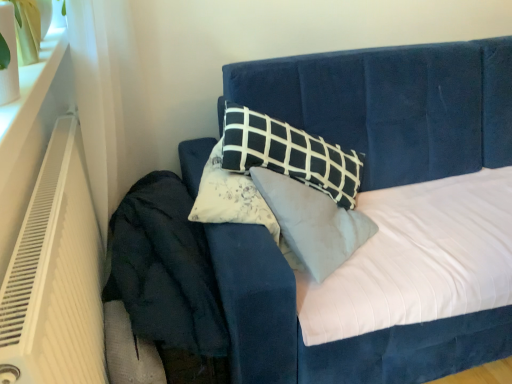
Measure the distance between velvet blue bed at center and camera.

They are 1.38 meters apart.

Describe the element at coordinates (55, 276) in the screenshot. Image resolution: width=512 pixels, height=384 pixels. I see `white plastic heater at left` at that location.

I want to click on velvet blue bed at center, so click(x=393, y=105).

Does white plastic heater at left turn towards dark blue velvet at lower left?

Yes, white plastic heater at left is oriented towards dark blue velvet at lower left.

Is white plastic heater at left touching dark blue velvet at lower left?

white plastic heater at left is not next to dark blue velvet at lower left, and they're not touching.

What's the angular difference between white plastic heater at left and dark blue velvet at lower left's facing directions?

90 degrees.

From a real-world perspective, between white plastic heater at left and dark blue velvet at lower left, who is vertically lower?

dark blue velvet at lower left is physically lower.

Which is more to the left, dark blue velvet at lower left or white plastic heater at left?

white plastic heater at left.

From a real-world perspective, between dark blue velvet at lower left and white plastic heater at left, who is vertically lower?

dark blue velvet at lower left is physically lower.

Is point (131, 210) closer or farther from the camera than point (41, 337)?

Point (131, 210) is positioned farther from the camera compared to point (41, 337).

Is white plastic heater at left thinner than velvet blue bed at center?

Correct, the width of white plastic heater at left is less than that of velvet blue bed at center.

Is point (94, 319) closer or farther from the camera than point (463, 149)?

Point (94, 319) appears to be closer to the viewer than point (463, 149).

Is velvet blue bed at center inside white plastic heater at left?

No, velvet blue bed at center is not a part of white plastic heater at left.

What's the angular difference between white plastic heater at left and velvet blue bed at center's facing directions?

89.5 degrees.

Between velvet blue bed at center and dark blue velvet at lower left, which one is positioned in front?

velvet blue bed at center is in front.

Is velvet blue bed at center outside of dark blue velvet at lower left?

Yes.

From the image's perspective, is velvet blue bed at center located above or below dark blue velvet at lower left?

From the image's perspective, velvet blue bed at center appears above dark blue velvet at lower left.

Find the location of `velvet located below the velvet blue bed at center (from the image's perspective)`. velvet located below the velvet blue bed at center (from the image's perspective) is located at coordinates (165, 268).

Is velvet blue bed at center facing away from white plastic heater at left?

velvet blue bed at center does not have its back to white plastic heater at left.

From a real-world perspective, is velvet blue bed at center above or below white plastic heater at left?

velvet blue bed at center is below white plastic heater at left.

Between velvet blue bed at center and white plastic heater at left, which one is positioned in front?

white plastic heater at left is closer to the camera.

Does velvet blue bed at center have a larger size compared to white plastic heater at left?

Correct, velvet blue bed at center is larger in size than white plastic heater at left.

From the picture: Is dark blue velvet at lower left facing away from velvet blue bed at center?

No, dark blue velvet at lower left is not facing away from velvet blue bed at center.

From a real-world perspective, between dark blue velvet at lower left and velvet blue bed at center, who is vertically higher?

velvet blue bed at center.

The height and width of the screenshot is (384, 512). Identify the location of velvet on the right of white plastic heater at left. (165, 268).

Where is `heater above the dark blue velvet at lower left (from the image's perspective)`? The image size is (512, 384). heater above the dark blue velvet at lower left (from the image's perspective) is located at coordinates [55, 276].

From the image, which object appears to be nearer to white plastic heater at left, dark blue velvet at lower left or velvet blue bed at center?

dark blue velvet at lower left lies closer to white plastic heater at left than the other object.

Estimate the real-world distances between objects in this image. Which object is closer to velvet blue bed at center, dark blue velvet at lower left or white plastic heater at left?

dark blue velvet at lower left is positioned closer to the anchor velvet blue bed at center.

Which object lies nearer to the anchor point dark blue velvet at lower left, white plastic heater at left or velvet blue bed at center?

Based on the image, white plastic heater at left appears to be nearer to dark blue velvet at lower left.

Based on their spatial positions, is white plastic heater at left or dark blue velvet at lower left further from velvet blue bed at center?

white plastic heater at left is positioned further to the anchor velvet blue bed at center.

Based on their spatial positions, is velvet blue bed at center or dark blue velvet at lower left further from white plastic heater at left?

velvet blue bed at center lies further to white plastic heater at left than the other object.

Based on the photo, considering their positions, is velvet blue bed at center positioned closer to dark blue velvet at lower left than white plastic heater at left?

white plastic heater at left.

Locate an element on the screen. velvet between white plastic heater at left and velvet blue bed at center from left to right is located at coordinates (165, 268).